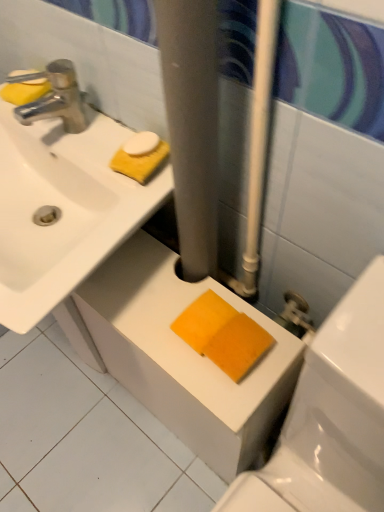
Question: From the image's perspective, does white glossy sink at upper left appear lower than chrome metallic faucet at upper left?

Choices:
 (A) yes
 (B) no

Answer: (A)

Question: Is white glossy sink at upper left thinner than chrome metallic faucet at upper left?

Choices:
 (A) yes
 (B) no

Answer: (B)

Question: Is white glossy sink at upper left wider than chrome metallic faucet at upper left?

Choices:
 (A) no
 (B) yes

Answer: (B)

Question: Is white glossy sink at upper left turned away from chrome metallic faucet at upper left?

Choices:
 (A) yes
 (B) no

Answer: (B)

Question: Can you confirm if white glossy sink at upper left is smaller than chrome metallic faucet at upper left?

Choices:
 (A) yes
 (B) no

Answer: (B)

Question: From the image's perspective, is yellow sponge at upper left, arranged as the 2th soap when ordered from the bottom, above or below yellow sponge at upper left, the 2th soap in the top-to-bottom sequence?

Choices:
 (A) above
 (B) below

Answer: (A)

Question: Considering the relative positions of yellow sponge at upper left, marked as the 1th soap in a top-to-bottom arrangement, and yellow sponge at upper left, which ranks as the 1th soap in bottom-to-top order, in the image provided, is yellow sponge at upper left, marked as the 1th soap in a top-to-bottom arrangement, to the left or to the right of yellow sponge at upper left, which ranks as the 1th soap in bottom-to-top order,?

Choices:
 (A) right
 (B) left

Answer: (A)

Question: Is yellow sponge at upper left, marked as the 1th soap in a top-to-bottom arrangement, situated inside yellow sponge at upper left, which ranks as the 1th soap in bottom-to-top order, or outside?

Choices:
 (A) outside
 (B) inside

Answer: (B)

Question: Is point (11, 81) positioned closer to the camera than point (16, 98)?

Choices:
 (A) closer
 (B) farther

Answer: (A)

Question: From the image's perspective, relative to chrome metallic faucet at upper left, is white glossy sink at upper left above or below?

Choices:
 (A) below
 (B) above

Answer: (A)

Question: Is white glossy sink at upper left situated inside chrome metallic faucet at upper left or outside?

Choices:
 (A) outside
 (B) inside

Answer: (A)

Question: Is point (49, 270) positioned closer to the camera than point (77, 113)?

Choices:
 (A) farther
 (B) closer

Answer: (B)

Question: In the image, is white glossy sink at upper left on the left side or the right side of chrome metallic faucet at upper left?

Choices:
 (A) right
 (B) left

Answer: (B)

Question: From a real-world perspective, is white glossy ceramic tile at lower center above or below orange sponge at lower center?

Choices:
 (A) below
 (B) above

Answer: (A)

Question: Do you think white glossy ceramic tile at lower center is within orange sponge at lower center, or outside of it?

Choices:
 (A) outside
 (B) inside

Answer: (A)